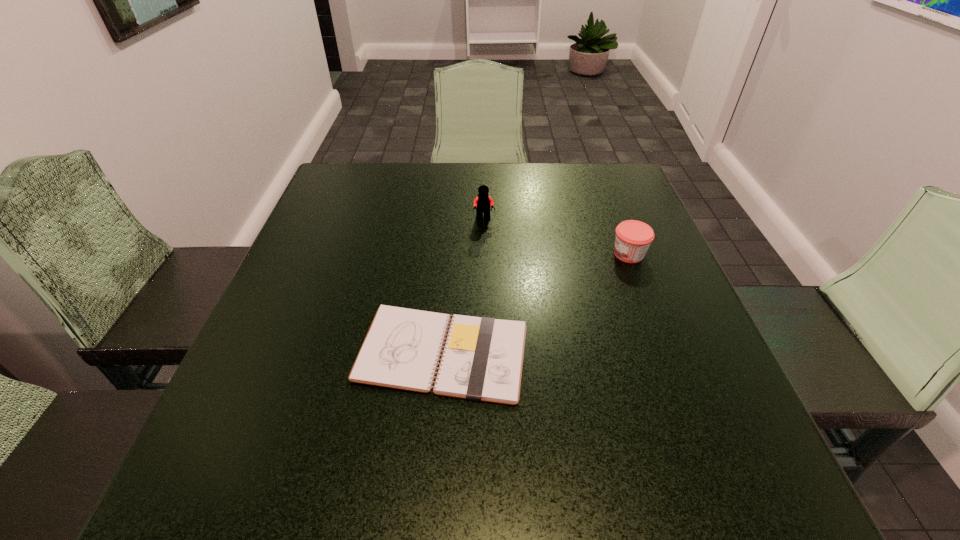
Image resolution: width=960 pixels, height=540 pixels. Identify the location of vacant point located 0.230m on the back of the notepad. (451, 238).

Image resolution: width=960 pixels, height=540 pixels. I want to click on object at the right edge, so click(633, 238).

At what (x,y) coordinates should I click in order to perform the action: click on vacant area at the far edge. Please return your answer as a coordinate pair (x, y). Image resolution: width=960 pixels, height=540 pixels. Looking at the image, I should click on (534, 192).

Where is `vacant point at the near edge`? The image size is (960, 540). vacant point at the near edge is located at coordinates (516, 508).

In the image, there is a desktop. What are the coordinates of `vacant space at the left edge` in the screenshot? It's located at (275, 333).

At what (x,y) coordinates should I click in order to perform the action: click on vacant point at the right edge. Please return your answer as a coordinate pair (x, y). Looking at the image, I should click on (709, 369).

You are a GUI agent. You are given a task and a screenshot of the screen. Output one action in this format:
    pyautogui.click(x=<x>, y=<y>)
    Task: Click on the free space at the far left corner of the desktop
    The image size is (960, 540).
    Given the screenshot: What is the action you would take?
    pyautogui.click(x=337, y=163)

Where is `free spot between the jam and the notepad`? The height and width of the screenshot is (540, 960). free spot between the jam and the notepad is located at coordinates (536, 303).

You are a GUI agent. You are given a task and a screenshot of the screen. Output one action in this format:
    pyautogui.click(x=<x>, y=<y>)
    Task: Click on the unoccupied position between the farthest object and the shortest object
    
    Given the screenshot: What is the action you would take?
    pyautogui.click(x=464, y=286)

I want to click on empty space that is in between the notepad and the Lego, so click(464, 286).